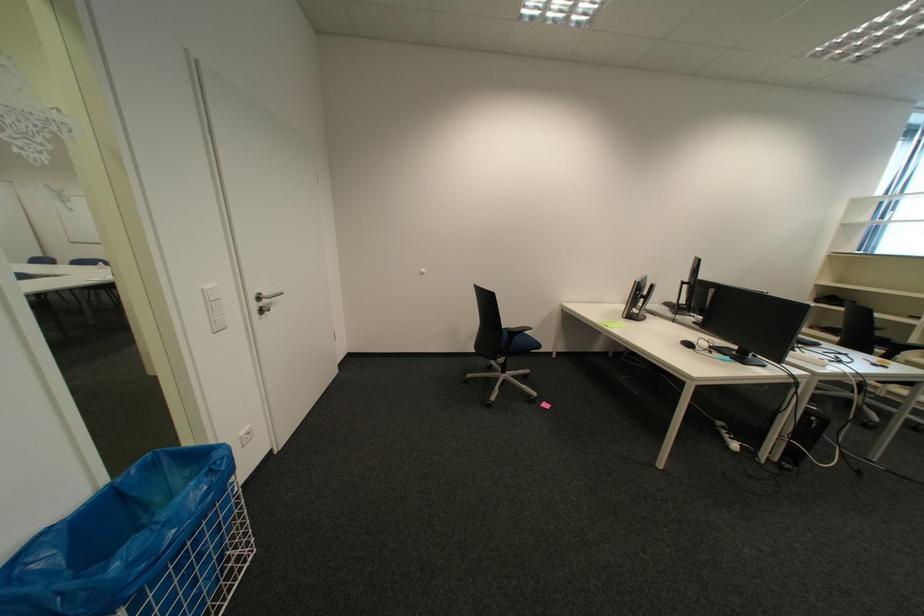
Where is `wire trash can`? wire trash can is located at coordinates (139, 543).